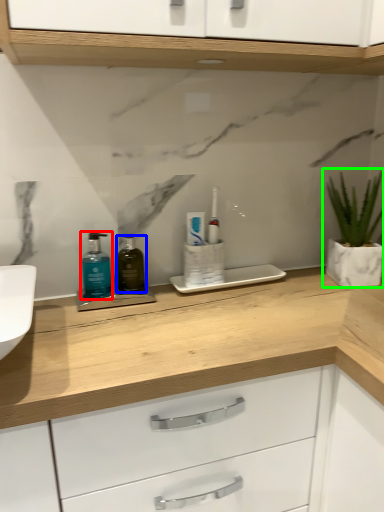
Question: Which is nearer to the mouthwash (highlighted by a red box)? mouthwash (highlighted by a blue box) or houseplant (highlighted by a green box).

Choices:
 (A) mouthwash
 (B) houseplant

Answer: (A)